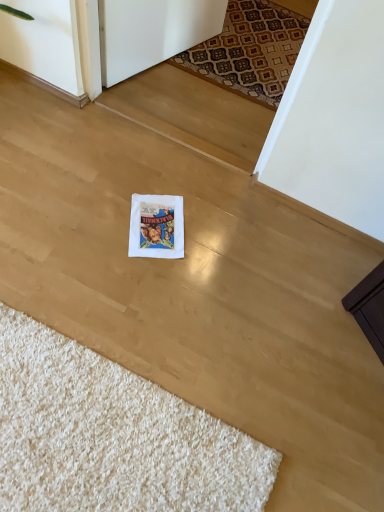
Identify the location of free location in front of white paper postcard at center. The image size is (384, 512). point(145,275).